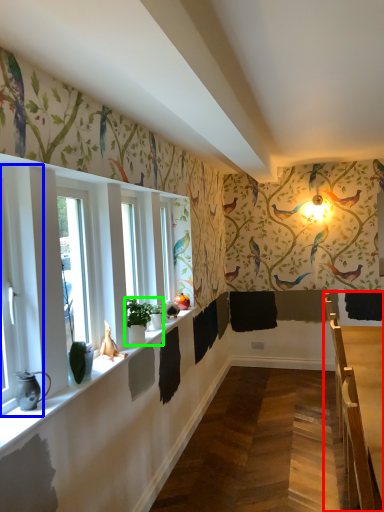
Question: Estimate the real-world distances between objects in this image. Which object is closer to table (highlighted by a red box), window (highlighted by a blue box) or houseplant (highlighted by a green box)?

Choices:
 (A) window
 (B) houseplant

Answer: (B)